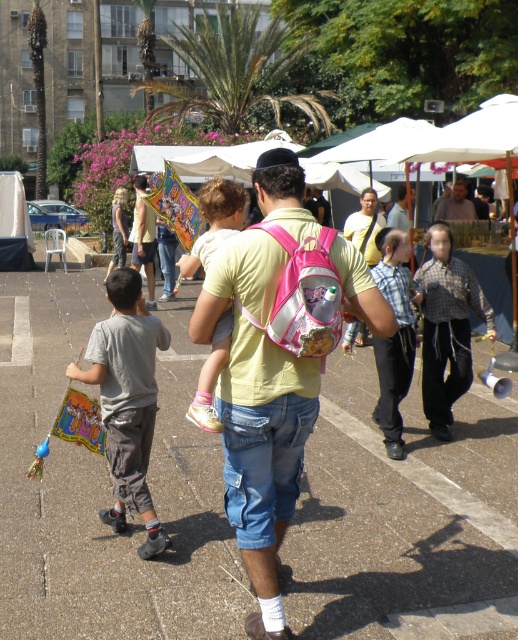
Is pink fabric dress at center bigger than light blue denim jeans at center?

No.

Is pink fabric dress at center to the left of light blue denim jeans at center from the viewer's perspective?

Indeed, pink fabric dress at center is positioned on the left side of light blue denim jeans at center.

The image size is (518, 640). What do you see at coordinates (214, 221) in the screenshot?
I see `pink fabric dress at center` at bounding box center [214, 221].

Where is `pink fabric dress at center`? This screenshot has width=518, height=640. pink fabric dress at center is located at coordinates (214, 221).

Is point (199, 424) closer to viewer compared to point (146, 259)?

Yes, point (199, 424) is closer to viewer.

Is pink fabric dress at center wider than yellow t-shirt at center?

In fact, pink fabric dress at center might be narrower than yellow t-shirt at center.

Find the location of a particular element. pink fabric dress at center is located at coordinates (214, 221).

You are a GUI agent. You are given a task and a screenshot of the screen. Output one action in this format:
    pyautogui.click(x=<x>, y=<y>)
    Task: Click on the pink fabric dress at center
    The image size is (518, 640).
    Given the screenshot: What is the action you would take?
    click(x=214, y=221)

Which is in front, point (253, 573) or point (443, 211)?

Point (253, 573) is in front.

Between point (291, 173) and point (441, 220), which one is positioned in front?

Point (291, 173)

Find the location of a particular element. The image size is (518, 640). pink fabric backpack at center is located at coordinates (262, 381).